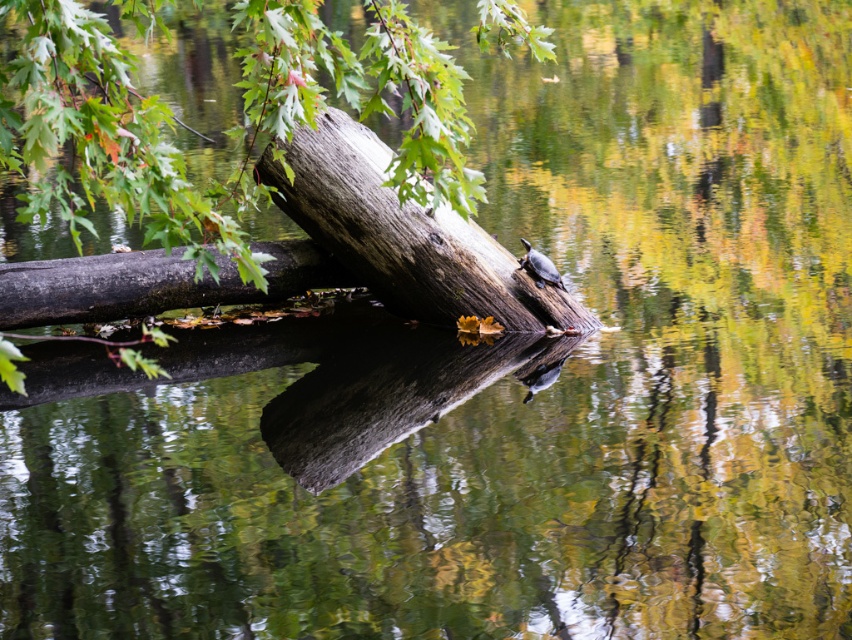
Between smooth brown log at center and brown rough tree trunk at center, which one appears on the right side from the viewer's perspective?

smooth brown log at center

Which is behind, point (373, 56) or point (141, 314)?

Positioned behind is point (141, 314).

You are a GUI agent. You are given a task and a screenshot of the screen. Output one action in this format:
    pyautogui.click(x=<x>, y=<y>)
    Task: Click on the smooth brown log at center
    The height and width of the screenshot is (640, 852).
    Given the screenshot: What is the action you would take?
    pyautogui.click(x=229, y=131)

Who is positioned more to the left, smooth brown log at center or gray rough log at center?

smooth brown log at center

Can you confirm if smooth brown log at center is positioned above gray rough log at center?

Yes.

Is point (450, 156) positioned after point (354, 256)?

No.

Locate an element on the screen. This screenshot has height=640, width=852. smooth brown log at center is located at coordinates (229, 131).

Is point (475, 292) in front of point (199, 301)?

Yes.

At what (x,y) coordinates should I click in order to perform the action: click on gray rough log at center. Please return your answer as a coordinate pair (x, y). The image size is (852, 640). Looking at the image, I should click on (404, 236).

You are a GUI agent. You are given a task and a screenshot of the screen. Output one action in this format:
    pyautogui.click(x=<x>, y=<y>)
    Task: Click on the gray rough log at center
    The image size is (852, 640).
    Given the screenshot: What is the action you would take?
    pyautogui.click(x=404, y=236)